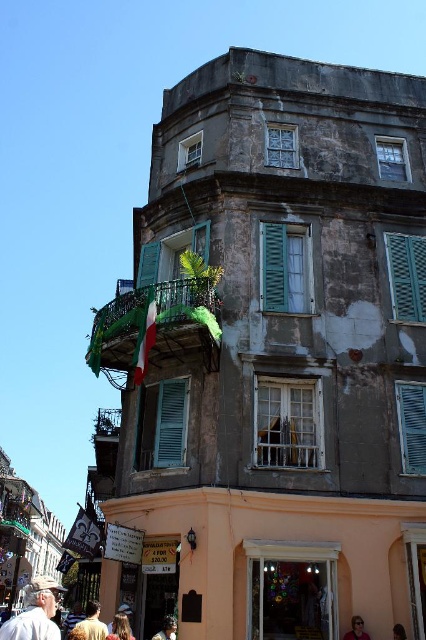
You are standing at the base of the historic building and want to reach the green wrought iron balcony at upper center. The safety regulations state that a ladder must be placed at a 75 degree angle to safely reach a height. What is the minimum length of ladder required to safely reach the balcony?

The green wrought iron balcony at upper center is 114.75 feet away from the viewer. To safely reach it with a ladder placed at a 75 degree angle, the minimum ladder length can be calculated using trigonometry. The formula is ladder length equals height divided by sine of the angle. Plugging in the numbers, 114.75 divided by sine of 75 degrees equals approximately 118.3 feet. Therefore, a ladder of at least 118.3 feet is required.

You are an artist sketching this building and notice two elements in the lower part of the image. Which one is taller between the white cotton shirt at lower left and the blonde hair at lower center?

The white cotton shirt at lower left is taller than the blonde hair at lower center.